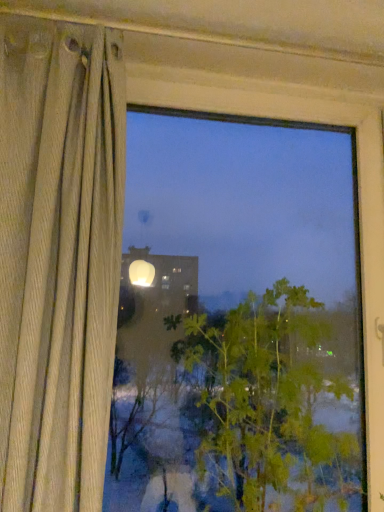
Question: Should I look upward or downward to see green leafy plant at center?

Choices:
 (A) down
 (B) up

Answer: (A)